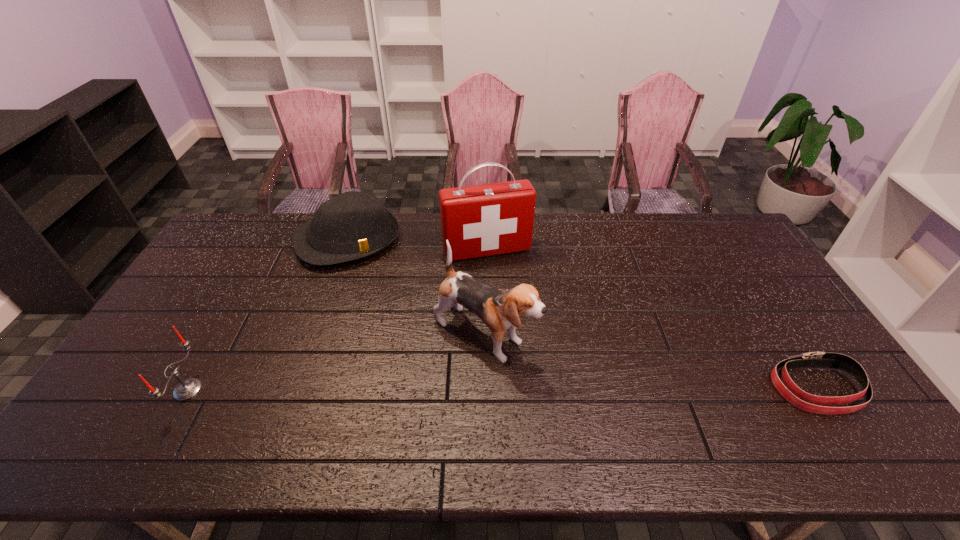
In the image, there is a desktop. Where is `free space at the right edge`? The image size is (960, 540). free space at the right edge is located at coordinates (817, 369).

Find the location of a particular element. The height and width of the screenshot is (540, 960). free space at the far left corner of the desktop is located at coordinates (245, 218).

Identify the location of vacant area at the near left corner. (162, 399).

The height and width of the screenshot is (540, 960). In the image, there is a desktop. Identify the location of free space at the far right corner. coord(717,221).

Locate an element on the screen. This screenshot has width=960, height=540. free space between the fourth object from right to left and the leftmost object is located at coordinates (268, 315).

Locate an element on the screen. empty location between the shortest object and the fourth shortest object is located at coordinates (651, 361).

Identify the location of vacant area between the shortest object and the second tallest object. This screenshot has width=960, height=540. (651, 361).

Locate an element on the screen. This screenshot has height=540, width=960. free space between the fedora and the candle is located at coordinates (268, 315).

The image size is (960, 540). In order to click on empty space that is in between the fedora and the first-aid kit in this screenshot , I will do `click(418, 245)`.

Image resolution: width=960 pixels, height=540 pixels. In order to click on vacant space that is in between the rightmost object and the puppy in this screenshot , I will do `click(651, 361)`.